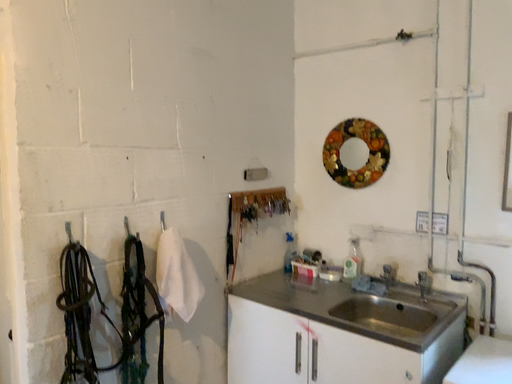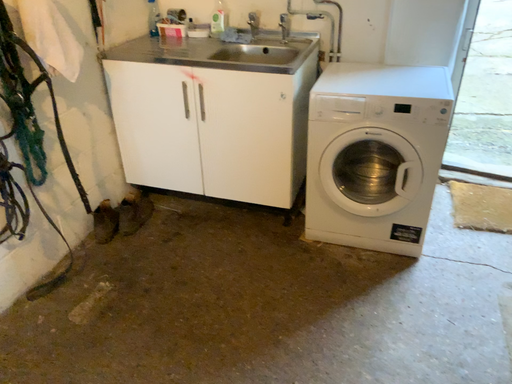
Question: How did the camera likely rotate when shooting the video?

Choices:
 (A) rotated left
 (B) rotated right

Answer: (B)